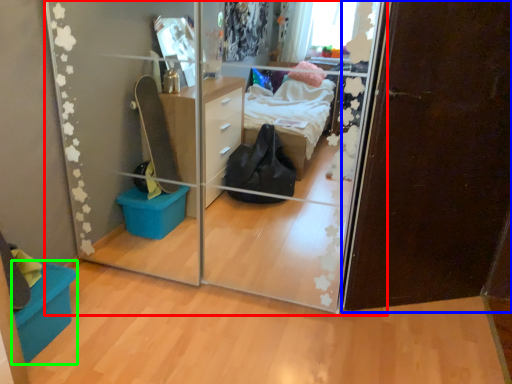
Question: Based on their relative distances, which object is nearer to glass door (highlighted by a red box)? Choose from door (highlighted by a blue box) and storage box (highlighted by a green box).

Choices:
 (A) door
 (B) storage box

Answer: (A)